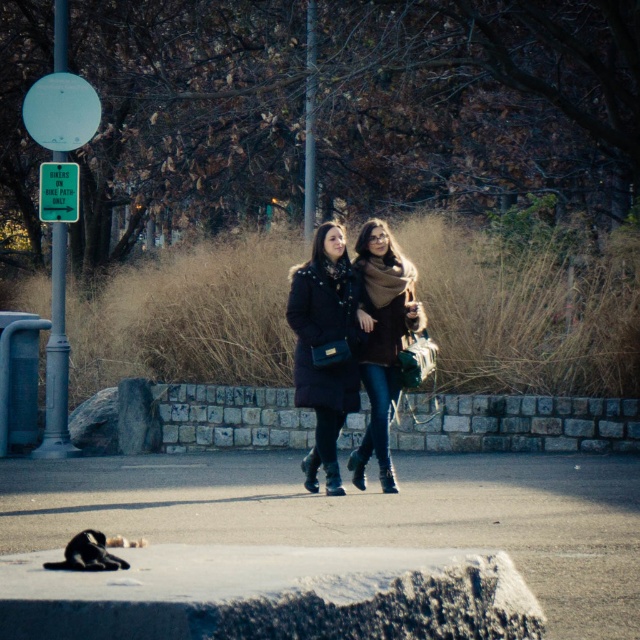
You are a photographer trying to capture a photo of the matte black coat at center and the concrete at center. Based on their positions, which object should you focus on first if you want to include both in your frame without moving the camera?

The concrete at center should be focused on first because it is positioned on the left side of the matte black coat at center, meaning it is closer to the camera. By focusing on the closer object, the depth of field may naturally include the farther object as well.

You are a photographer trying to capture the scene. You want to focus on the brown woolen scarf at center without the concrete at center being in the foreground. Is this possible?

The concrete at center is closer to the viewer than the brown woolen scarf at center, so the concrete will block the view of the scarf. You cannot focus on the brown woolen scarf at center without the concrete at center being in the foreground.